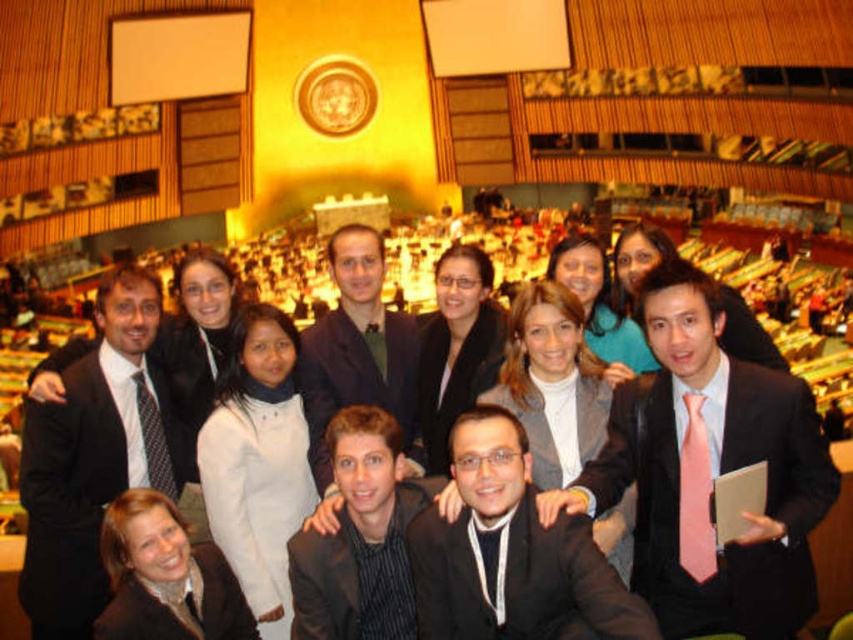
Question: Is black suit at center above matte black jacket at center?

Choices:
 (A) no
 (B) yes

Answer: (A)

Question: Which point appears closest to the camera in this image?

Choices:
 (A) (141, 365)
 (B) (462, 273)

Answer: (A)

Question: Is pink satin tie at center thinner than matte black jacket at center?

Choices:
 (A) yes
 (B) no

Answer: (B)

Question: Based on their relative distances, which object is nearer to the black matte blazer at lower left?

Choices:
 (A) black textured suit at center
 (B) black suit at center
 (C) matte black suit at center

Answer: (A)

Question: Which point is closer to the camera?

Choices:
 (A) black matte blazer at lower left
 (B) black suit at center

Answer: (B)

Question: Is dark blue suit at center closer to camera compared to black textured suit at center?

Choices:
 (A) no
 (B) yes

Answer: (A)